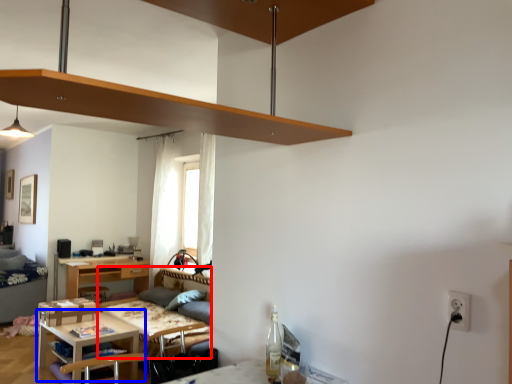
Question: Which point is further to the camera, couch (highlighted by a red box) or table (highlighted by a blue box)?

Choices:
 (A) couch
 (B) table

Answer: (B)